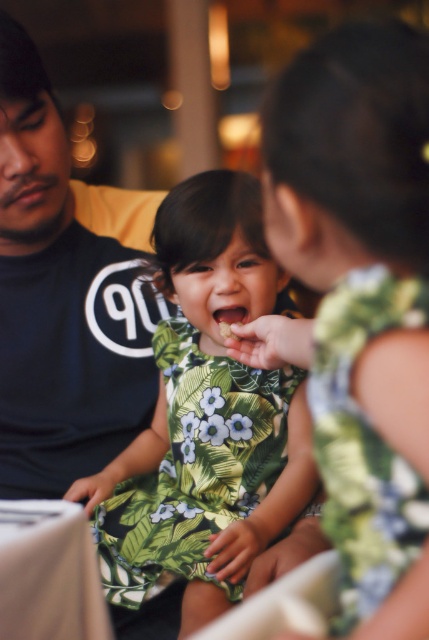
Can you confirm if green leafy dress at center is positioned to the left of green floral fabric dress at center?

Yes, green leafy dress at center is to the left of green floral fabric dress at center.

Who is taller, green leafy dress at center or green floral fabric dress at center?

green leafy dress at center is taller.

Is point (201, 461) in front of point (395, 563)?

No, it is not.

Find the location of a particular element. The image size is (429, 640). green leafy dress at center is located at coordinates point(208,413).

Measure the distance between point (224,579) and camera.

A distance of 3.49 feet exists between point (224,579) and camera.

From the picture: Is green leafy dress at center smaller than black cotton shirt at left?

No, green leafy dress at center is not smaller than black cotton shirt at left.

Which is in front, point (214, 445) or point (54, 218)?

Point (214, 445)

You are a GUI agent. You are given a task and a screenshot of the screen. Output one action in this format:
    pyautogui.click(x=<x>, y=<y>)
    Task: Click on the green leafy dress at center
    This screenshot has width=429, height=640.
    Given the screenshot: What is the action you would take?
    pyautogui.click(x=208, y=413)

Who is higher up, black cotton shirt at left or green floral fabric dress at center?

Positioned higher is black cotton shirt at left.

Can you confirm if black cotton shirt at left is bigger than green floral fabric dress at center?

Indeed, black cotton shirt at left has a larger size compared to green floral fabric dress at center.

Who is more distant from viewer, (5, 108) or (347, 396)?

The point (5, 108) is behind.

Where is `black cotton shirt at left`? The width and height of the screenshot is (429, 640). black cotton shirt at left is located at coordinates (60, 301).